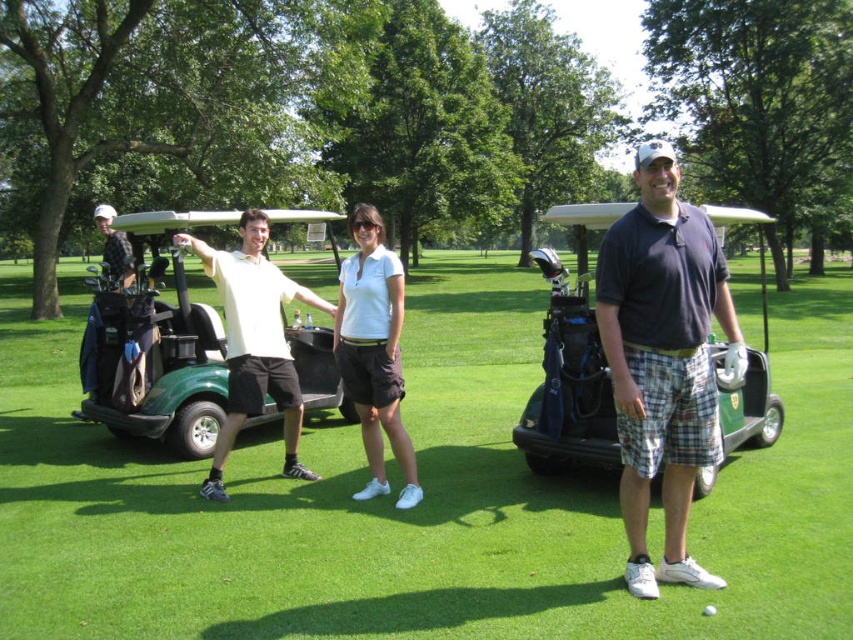
Question: Which object is closer to the camera taking this photo?

Choices:
 (A) white matte shorts at center
 (B) matte black golf bag at left
 (C) green grass at center

Answer: (C)

Question: Can you confirm if dark blue polo shirt at center is positioned above matte black golf bag at left?

Choices:
 (A) no
 (B) yes

Answer: (A)

Question: Does dark blue polo shirt at center appear on the right side of white matte shorts at center?

Choices:
 (A) no
 (B) yes

Answer: (B)

Question: Which point is closer to the camera?

Choices:
 (A) matte black golf bag at left
 (B) white matte shorts at center
 (C) white matte golf ball at center

Answer: (C)

Question: Which is nearer to the matte black golf bag at left?

Choices:
 (A) green matte golf cart at left
 (B) dark blue polo shirt at center
 (C) green grass at center
 (D) white matte golf ball at center

Answer: (A)

Question: Can you confirm if green grass at center is wider than dark blue fabric golf cart at center?

Choices:
 (A) yes
 (B) no

Answer: (A)